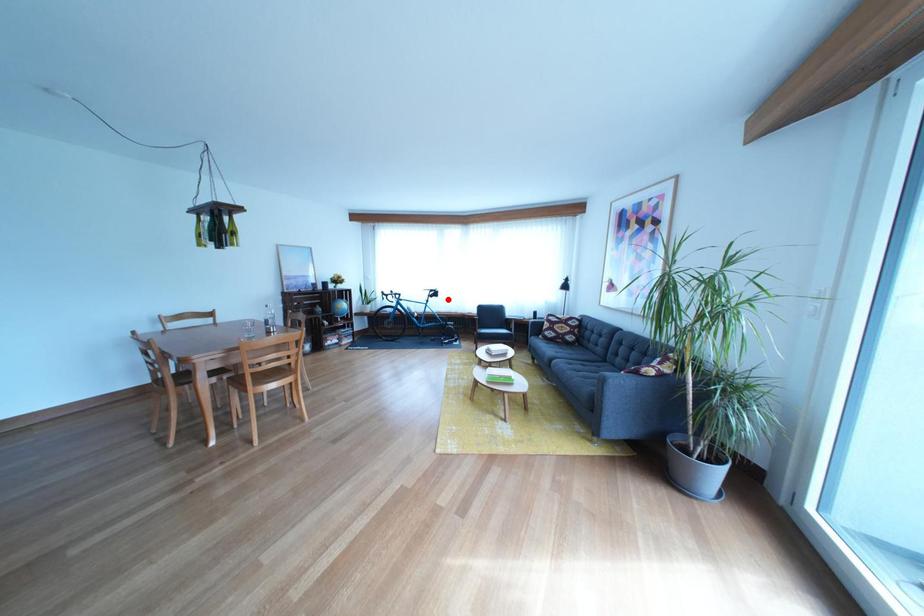
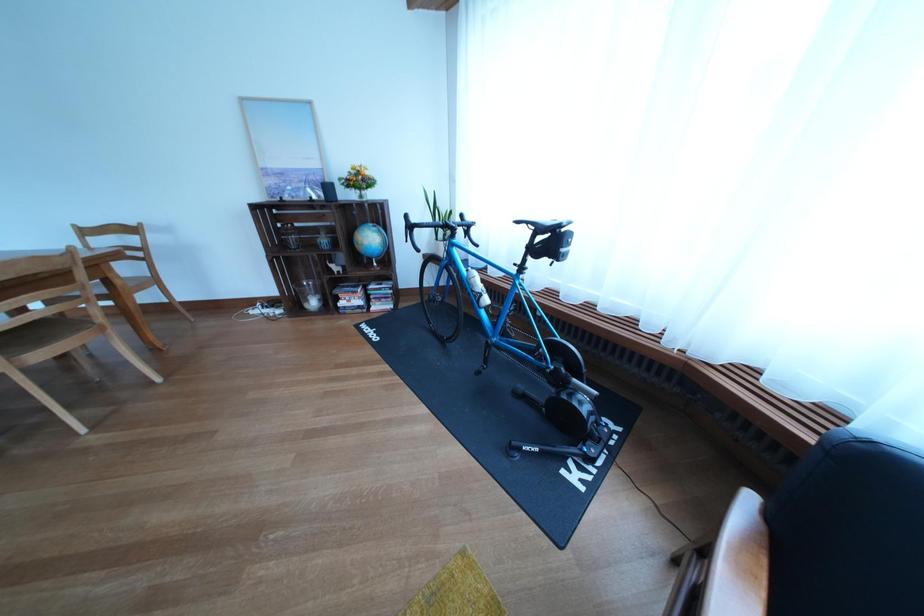
Find the pixel in the second image that matches the highlighted location in the first image.

(563, 248)